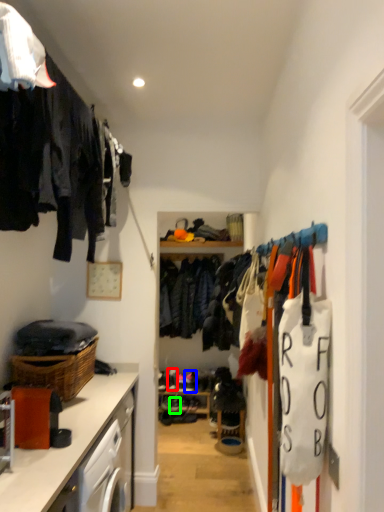
Question: Estimate the real-world distances between objects in this image. Which object is closer to shoe (highlighted by a red box), shoe (highlighted by a blue box) or shoe (highlighted by a green box)?

Choices:
 (A) shoe
 (B) shoe

Answer: (A)